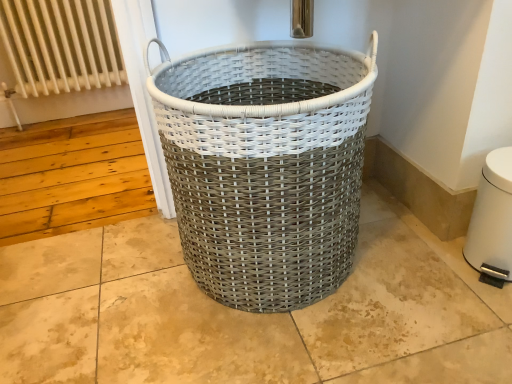
What do you see at coordinates (266, 167) in the screenshot? I see `white woven basket at center` at bounding box center [266, 167].

The width and height of the screenshot is (512, 384). What do you see at coordinates (61, 57) in the screenshot? I see `white metal radiator at upper left` at bounding box center [61, 57].

Describe the element at coordinates (492, 221) in the screenshot. I see `white plastic water heater at lower right` at that location.

Where is `white woven basket at center`? The height and width of the screenshot is (384, 512). white woven basket at center is located at coordinates (266, 167).

Considering the sizes of objects white woven basket at center and white plastic water heater at lower right in the image provided, who is bigger, white woven basket at center or white plastic water heater at lower right?

Bigger between the two is white woven basket at center.

Which is more to the right, white woven basket at center or white plastic water heater at lower right?

From the viewer's perspective, white plastic water heater at lower right appears more on the right side.

Can you confirm if white woven basket at center is thinner than white plastic water heater at lower right?

In fact, white woven basket at center might be wider than white plastic water heater at lower right.

Considering the sizes of white woven basket at center and white plastic water heater at lower right in the image, is white woven basket at center taller or shorter than white plastic water heater at lower right?

In the image, white woven basket at center appears to be taller than white plastic water heater at lower right.

This screenshot has width=512, height=384. What are the coordinates of `water heater below the white metal radiator at upper left (from a real-world perspective)` in the screenshot? It's located at (492, 221).

Is white plastic water heater at lower right taller than white metal radiator at upper left?

No, white plastic water heater at lower right is not taller than white metal radiator at upper left.

Is white metal radiator at upper left a part of white plastic water heater at lower right?

Actually, white metal radiator at upper left is outside white plastic water heater at lower right.

From a real-world perspective, between white metal radiator at upper left and white woven basket at center, who is vertically lower?

In real-world perspective, white metal radiator at upper left is lower.

Is white metal radiator at upper left behind white woven basket at center?

Yes, white metal radiator at upper left is further from the viewer.

From the image's perspective, relative to white woven basket at center, is white metal radiator at upper left above or below?

From the image's perspective, white metal radiator at upper left appears above white woven basket at center.

I want to click on waste container on the right of the white metal radiator at upper left, so click(266, 167).

Considering the relative sizes of white plastic water heater at lower right and white woven basket at center in the image provided, is white plastic water heater at lower right taller than white woven basket at center?

No.

Where is `water heater behind the white woven basket at center`? The height and width of the screenshot is (384, 512). water heater behind the white woven basket at center is located at coordinates (492, 221).

From the image's perspective, does white plastic water heater at lower right appear lower than white woven basket at center?

Yes, from the image's perspective, white plastic water heater at lower right is below white woven basket at center.

Consider the image. From the image's perspective, between white metal radiator at upper left and white plastic water heater at lower right, who is located below?

white plastic water heater at lower right, from the image's perspective.

From the picture: How much distance is there between white metal radiator at upper left and white plastic water heater at lower right?

The distance of white metal radiator at upper left from white plastic water heater at lower right is 5.74 feet.

Considering the points (94, 63) and (501, 211), which point is in front, point (94, 63) or point (501, 211)?

The point (501, 211) is in front.

From a real-world perspective, is white metal radiator at upper left over white plastic water heater at lower right?

Indeed, from a real-world perspective, white metal radiator at upper left stands above white plastic water heater at lower right.

From a real-world perspective, relative to white metal radiator at upper left, is white woven basket at center vertically above or below?

From a real-world perspective, white woven basket at center is physically above white metal radiator at upper left.

I want to click on radiator behind the white woven basket at center, so (x=61, y=57).

Looking at this image, in the image, is white woven basket at center positioned in front of or behind white metal radiator at upper left?

In the image, white woven basket at center appears in front of white metal radiator at upper left.

Locate an element on the screen. The image size is (512, 384). waste container in front of the white plastic water heater at lower right is located at coordinates (266, 167).

You are a GUI agent. You are given a task and a screenshot of the screen. Output one action in this format:
    pyautogui.click(x=<x>, y=<y>)
    Task: Click on the water heater on the right side of white metal radiator at upper left
    
    Given the screenshot: What is the action you would take?
    pyautogui.click(x=492, y=221)

Based on their spatial positions, is white metal radiator at upper left or white plastic water heater at lower right closer to white woven basket at center?

white plastic water heater at lower right is positioned closer to the anchor white woven basket at center.

From the image, which object appears to be nearer to white woven basket at center, white plastic water heater at lower right or white metal radiator at upper left?

white plastic water heater at lower right is closer to white woven basket at center.

From the image, which object appears to be farther from white plastic water heater at lower right, white woven basket at center or white metal radiator at upper left?

The object further to white plastic water heater at lower right is white metal radiator at upper left.

Considering their positions, is white plastic water heater at lower right positioned closer to white metal radiator at upper left than white woven basket at center?

white woven basket at center is closer to white metal radiator at upper left.

From the image, which object appears to be farther from white plastic water heater at lower right, white metal radiator at upper left or white woven basket at center?

white metal radiator at upper left lies further to white plastic water heater at lower right than the other object.

Consider the image. Which object lies nearer to the anchor point white metal radiator at upper left, white woven basket at center or white plastic water heater at lower right?

white woven basket at center lies closer to white metal radiator at upper left than the other object.

This screenshot has width=512, height=384. Find the location of `waste container between white metal radiator at upper left and white plastic water heater at lower right`. waste container between white metal radiator at upper left and white plastic water heater at lower right is located at coordinates (266, 167).